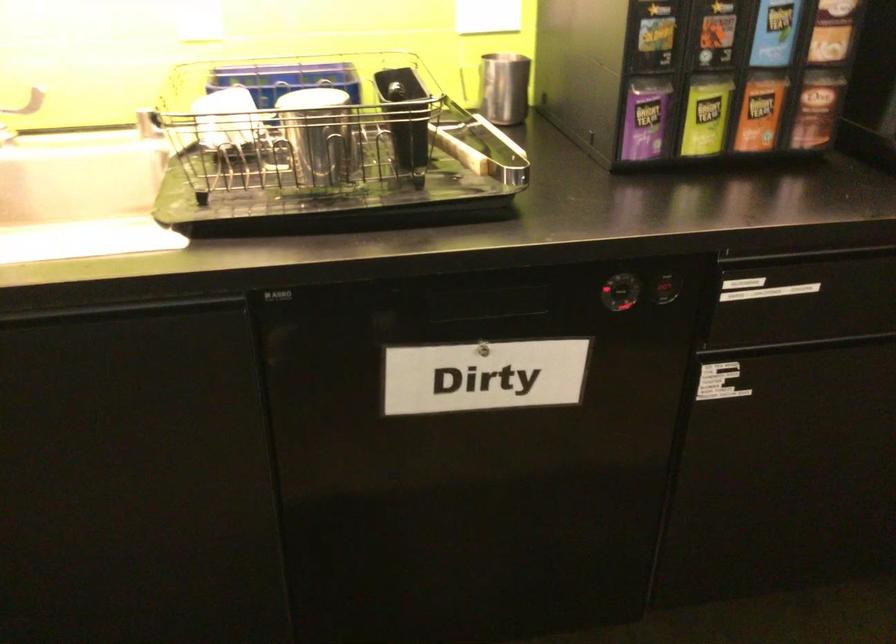
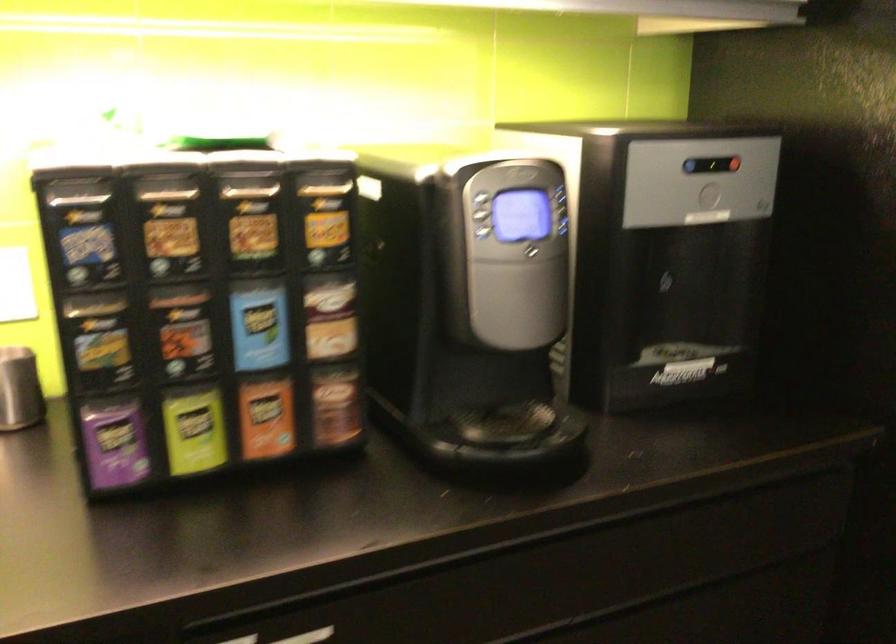
In the second image, find the point that corresponds to pixel 519 87 in the first image.

(19, 389)